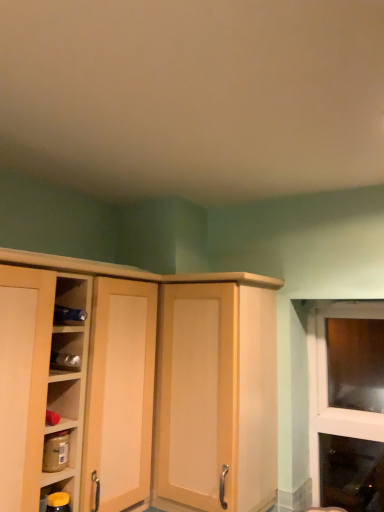
Question: Is matte brown jar at lower left, the second shelf in the bottom-to-top sequence, facing towards yellow matte jar at lower left, the first shelf when ordered from bottom to top?

Choices:
 (A) no
 (B) yes

Answer: (A)

Question: Is matte brown jar at lower left, arranged as the 1th shelf when viewed from the top, closer to the viewer compared to yellow matte jar at lower left, the first shelf when ordered from bottom to top?

Choices:
 (A) no
 (B) yes

Answer: (A)

Question: Is matte brown jar at lower left, arranged as the 1th shelf when viewed from the top, bigger than yellow matte jar at lower left, the first shelf when ordered from bottom to top?

Choices:
 (A) yes
 (B) no

Answer: (A)

Question: Does matte brown jar at lower left, the second shelf in the bottom-to-top sequence, touch yellow matte jar at lower left, the first shelf when ordered from bottom to top?

Choices:
 (A) no
 (B) yes

Answer: (B)

Question: Does matte brown jar at lower left, the second shelf in the bottom-to-top sequence, have a lesser height compared to yellow matte jar at lower left, the second shelf positioned from the top?

Choices:
 (A) no
 (B) yes

Answer: (A)

Question: Considering the positions of matte wood cabinet at center and yellow matte jar at lower left, the first shelf when ordered from bottom to top, in the image, is matte wood cabinet at center taller or shorter than yellow matte jar at lower left, the first shelf when ordered from bottom to top,?

Choices:
 (A) short
 (B) tall

Answer: (B)

Question: Looking at the image, does matte wood cabinet at center seem bigger or smaller compared to yellow matte jar at lower left, the second shelf positioned from the top?

Choices:
 (A) big
 (B) small

Answer: (A)

Question: Is matte wood cabinet at center in front of or behind yellow matte jar at lower left, the first shelf when ordered from bottom to top, in the image?

Choices:
 (A) front
 (B) behind

Answer: (B)

Question: Considering the positions of matte wood cabinet at center and yellow matte jar at lower left, the first shelf when ordered from bottom to top, in the image, is matte wood cabinet at center wider or thinner than yellow matte jar at lower left, the first shelf when ordered from bottom to top,?

Choices:
 (A) wide
 (B) thin

Answer: (A)

Question: Is point (59, 502) closer or farther from the camera than point (258, 505)?

Choices:
 (A) closer
 (B) farther

Answer: (A)

Question: In the image, is yellow matte jar at lower left, the second shelf positioned from the top, positioned in front of or behind matte wood cupboard at left?

Choices:
 (A) front
 (B) behind

Answer: (B)

Question: Would you say yellow matte jar at lower left, the first shelf when ordered from bottom to top, is to the left or to the right of matte wood cupboard at left in the picture?

Choices:
 (A) left
 (B) right

Answer: (B)

Question: From the image's perspective, is yellow matte jar at lower left, the second shelf positioned from the top, above or below matte wood cupboard at left?

Choices:
 (A) below
 (B) above

Answer: (A)

Question: Is matte wood cupboard at left bigger or smaller than yellow matte jar at lower left, the first shelf when ordered from bottom to top?

Choices:
 (A) big
 (B) small

Answer: (A)

Question: In the image, is matte wood cupboard at left on the left side or the right side of yellow matte jar at lower left, the second shelf positioned from the top?

Choices:
 (A) right
 (B) left

Answer: (B)